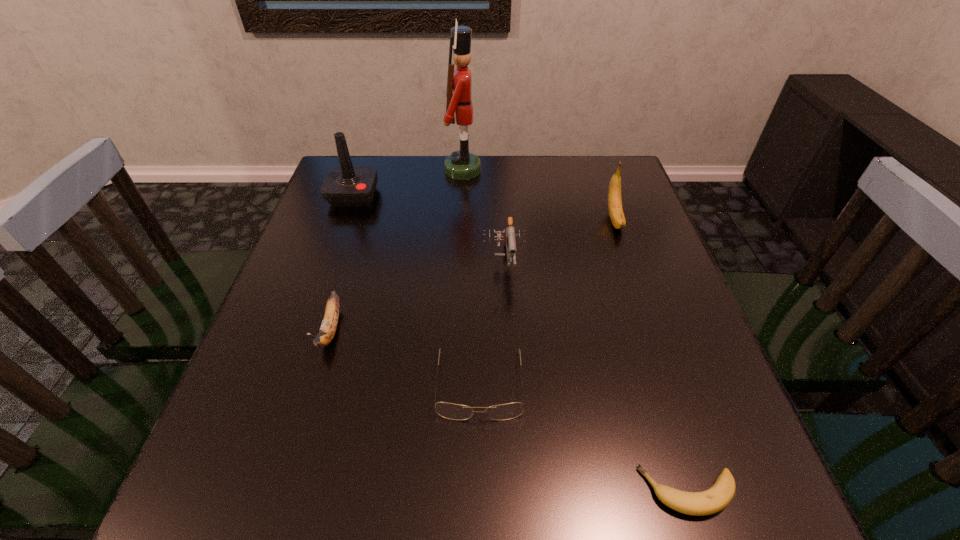
The height and width of the screenshot is (540, 960). What are the coordinates of `free space located at the stem of the shortest banana` in the screenshot? It's located at (563, 491).

This screenshot has width=960, height=540. Find the location of `nutcracker at the far edge`. nutcracker at the far edge is located at coordinates (461, 165).

Find the location of `joystick situated at the far edge`. joystick situated at the far edge is located at coordinates (346, 186).

Find the location of a particular element. The height and width of the screenshot is (540, 960). object situated at the near edge is located at coordinates (716, 498).

Locate an element on the screen. The image size is (960, 540). joystick that is at the left edge is located at coordinates (346, 186).

The height and width of the screenshot is (540, 960). What are the coordinates of `banana present at the left edge` in the screenshot? It's located at (328, 327).

Where is `object that is at the far left corner`? object that is at the far left corner is located at coordinates (346, 186).

Find the location of a particular element. Image resolution: width=960 pixels, height=540 pixels. object that is at the near right corner is located at coordinates (716, 498).

In the image, there is a desktop. Find the location of `vacant space at the far edge`. vacant space at the far edge is located at coordinates (552, 195).

Locate an element on the screen. Image resolution: width=960 pixels, height=540 pixels. vacant space at the near edge of the desktop is located at coordinates (546, 489).